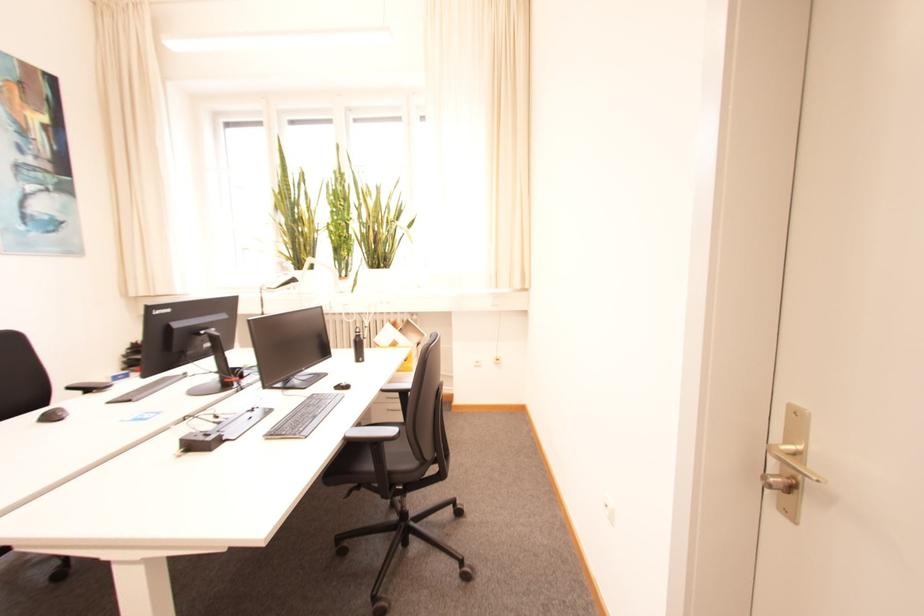
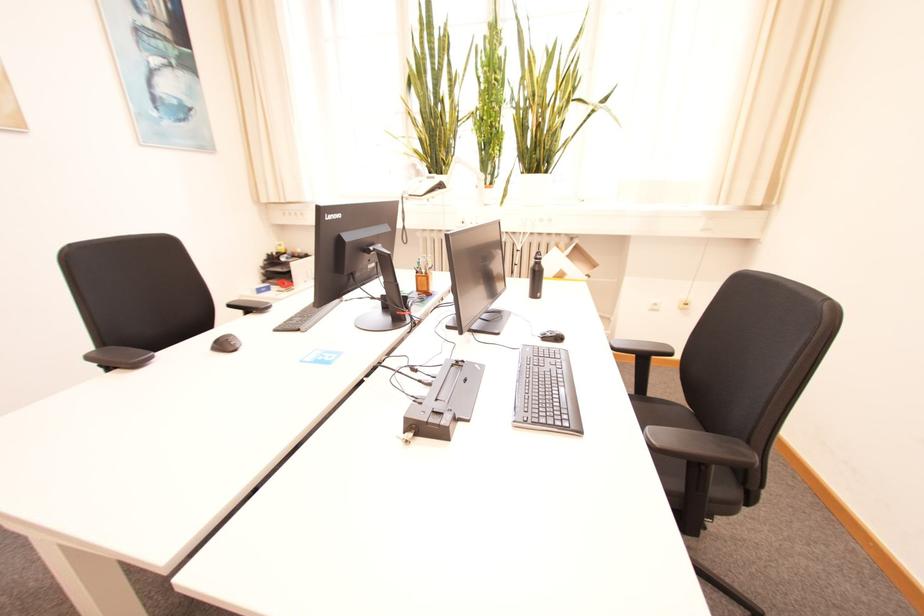
The point at (57, 419) is marked in the first image. Where is the corresponding point in the second image?

(229, 346)